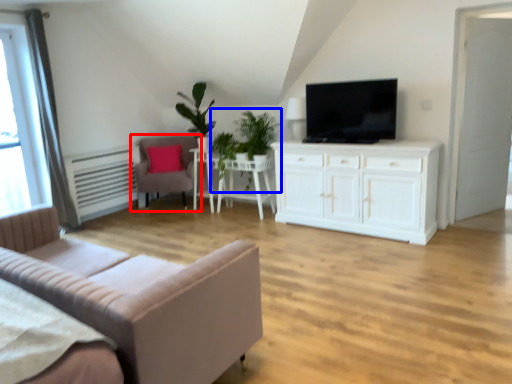
Question: Which point is further to the camera, chair (highlighted by a red box) or plant (highlighted by a blue box)?

Choices:
 (A) chair
 (B) plant

Answer: (A)